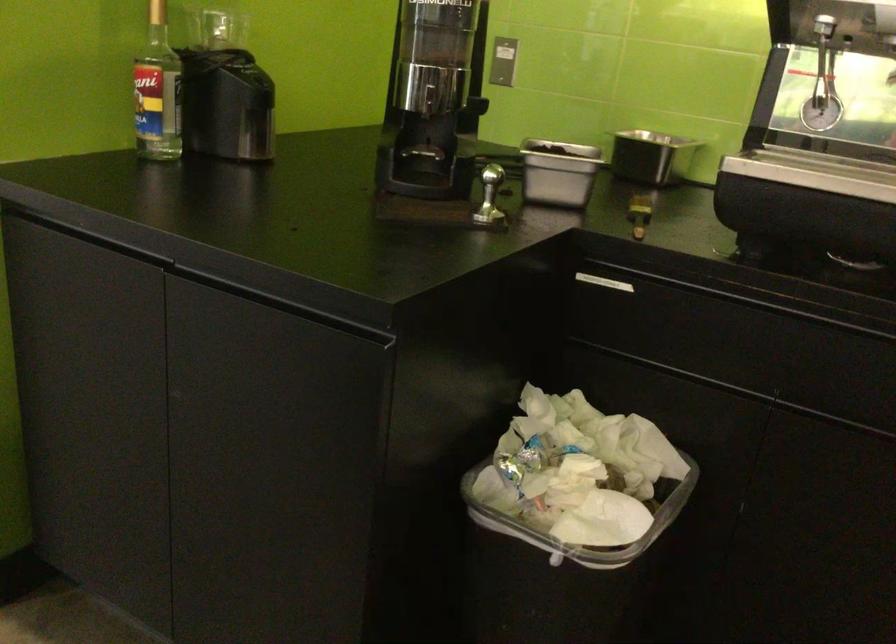
The width and height of the screenshot is (896, 644). Describe the element at coordinates (158, 91) in the screenshot. I see `a clear glass bottle` at that location.